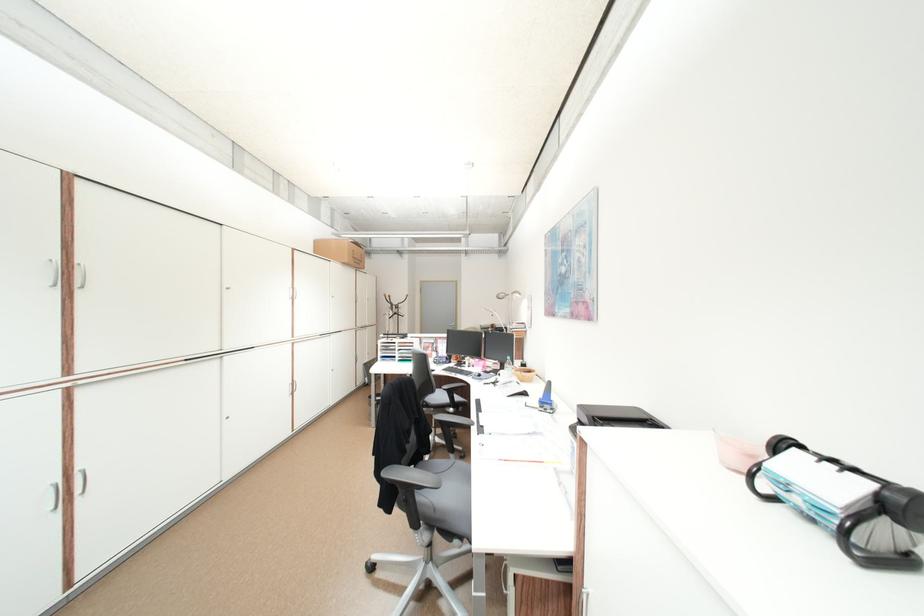
Where is `printer lid`? printer lid is located at coordinates (615, 416).